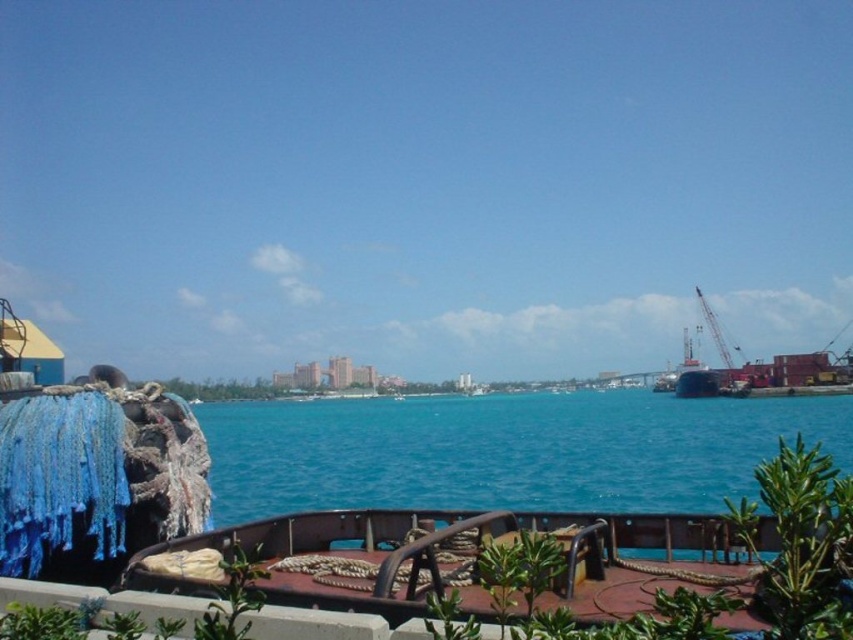
Based on the photo, measure the distance between blue water at center and metallic gray crane at right.

They are 45.74 meters apart.

Does point (521, 397) come closer to viewer compared to point (706, 308)?

No, (521, 397) is further to viewer.

Between point (408, 484) and point (727, 358), which one is positioned in front?

Point (408, 484)

Image resolution: width=853 pixels, height=640 pixels. What are the coordinates of `blue water at center` in the screenshot? It's located at (505, 451).